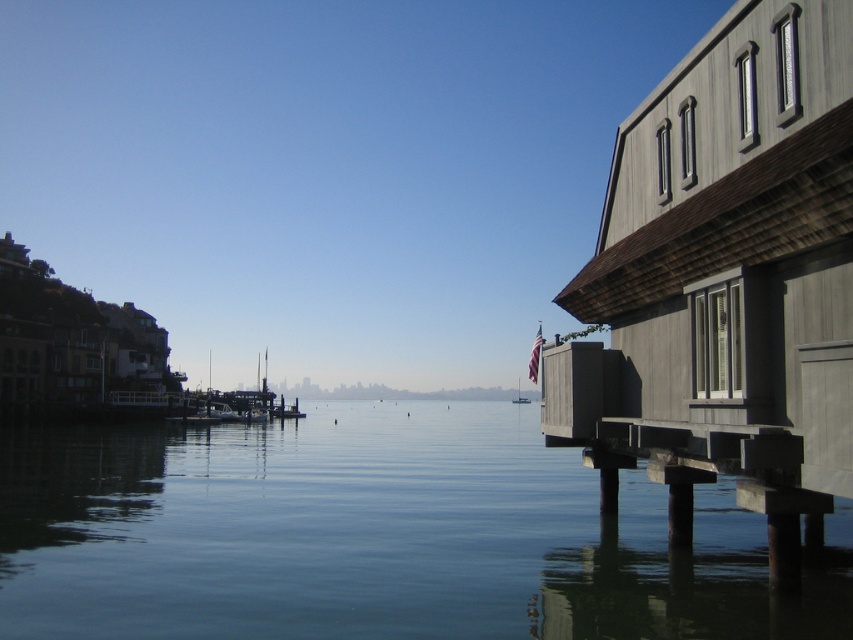
Which of these two, clear water at center or white plastic boat at center, stands shorter?

With less height is white plastic boat at center.

Can you confirm if clear water at center is positioned below white plastic boat at center?

No, clear water at center is not below white plastic boat at center.

Which is in front, point (170, 632) or point (517, 392)?

Point (170, 632)

Find the location of a particular element. The width and height of the screenshot is (853, 640). clear water at center is located at coordinates (375, 536).